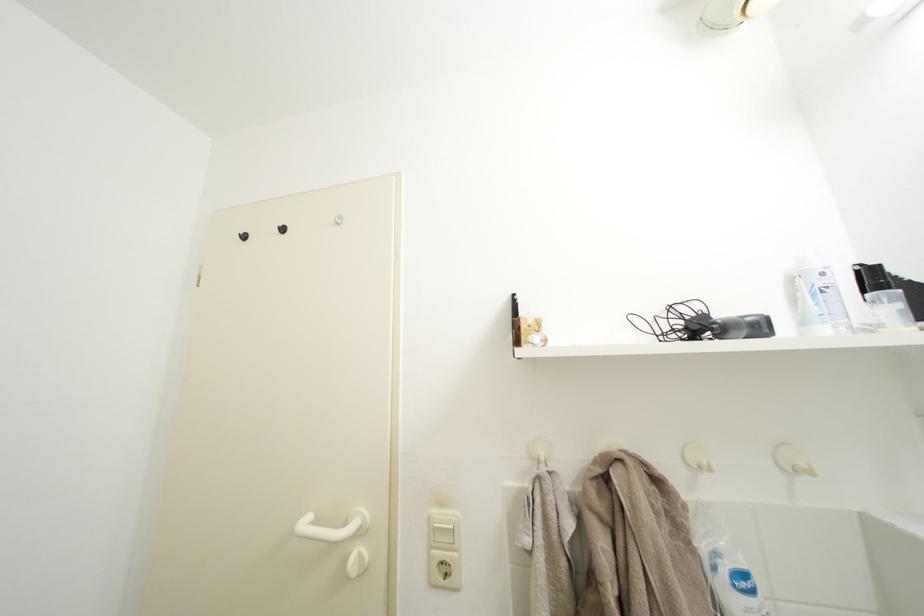
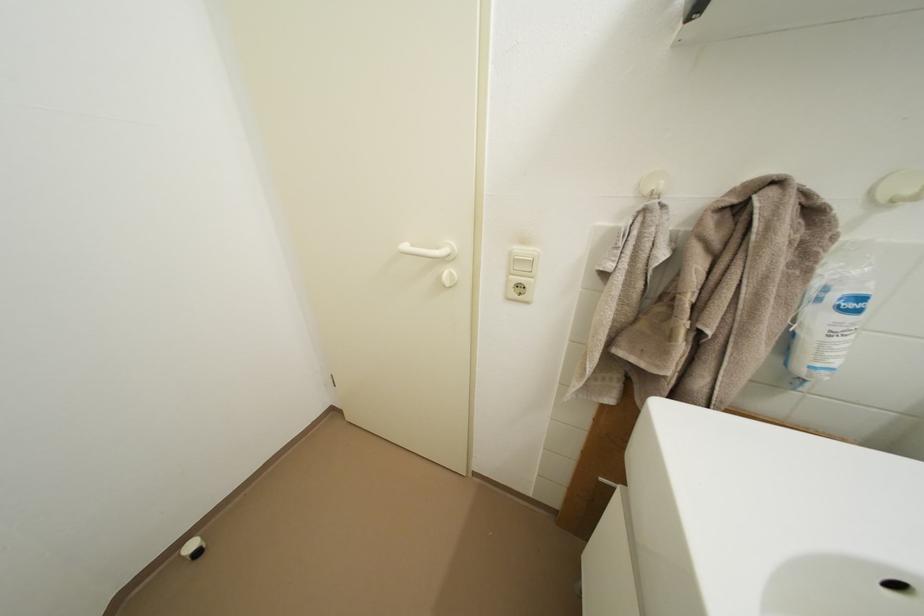
Question: Based on the continuous images, in which direction is the camera rotating? Reply with the corresponding letter.

Choices:
 (A) Left
 (B) Right
 (C) Up
 (D) Down

Answer: (D)